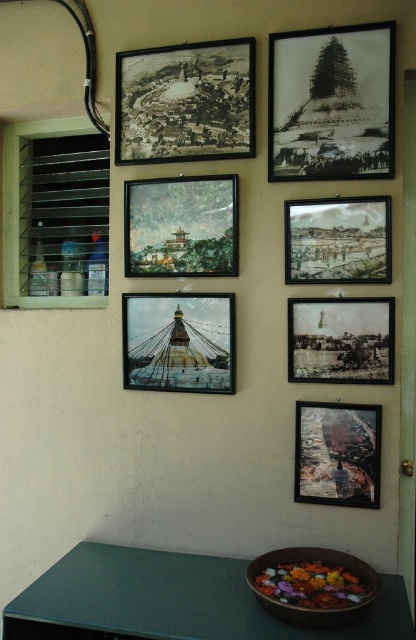
You are standing in front of the wall with the seven framed photographs. You notice the metallic gold stupa at center and the wooden textured painting at lower right. Which object is positioned to the right side of the other?

The wooden textured painting at lower right is to the right of the metallic gold stupa at center.

Looking at this image, you are standing at the camera position and want to take a photo of the black paper photograph at upper right. Can you reach it with your camera if the maximum distance your camera can focus is 5 feet?

The black paper photograph at upper right and camera are 5.49 feet apart from each other. Since the maximum focus distance is 5 feet, the camera cannot focus on the black paper photograph at upper right because it is beyond the 5 feet limit.

You are an interior designer planning to hang a new artwork on this wall. You notice the black paper map at upper left and the matte paper painting at center. Which object is placed higher on the wall?

The black paper map at upper left is positioned over the matte paper painting at center, meaning it is placed higher on the wall.